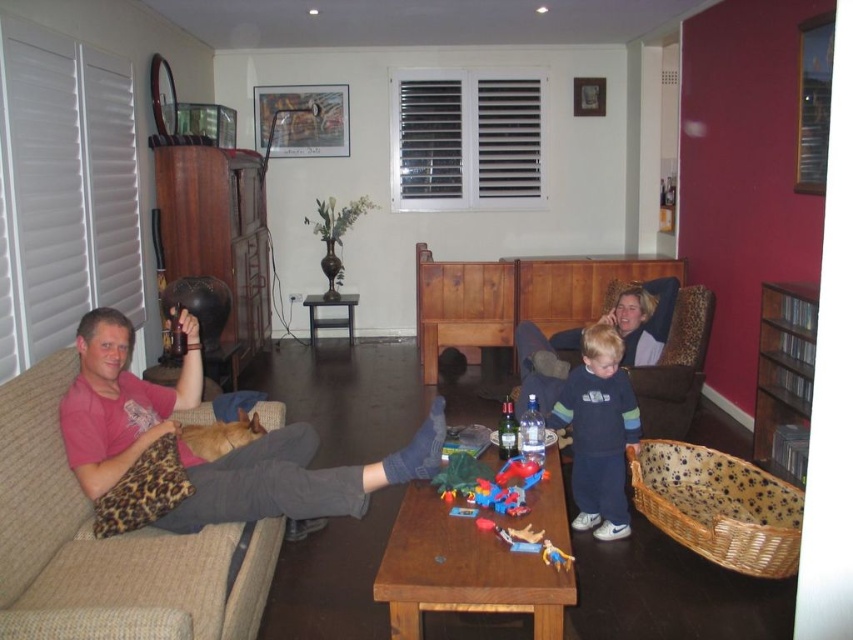
Image resolution: width=853 pixels, height=640 pixels. What do you see at coordinates (108, 545) in the screenshot?
I see `beige fabric couch at left` at bounding box center [108, 545].

Can you confirm if beige fabric couch at left is bigger than dark blue fleece at center?

Yes, beige fabric couch at left is bigger than dark blue fleece at center.

This screenshot has width=853, height=640. I want to click on beige fabric couch at left, so click(x=108, y=545).

Is point (96, 397) in front of point (630, 412)?

Yes, it is.

At what (x,y) coordinates should I click in order to perform the action: click on pink cotton shirt at left. Please return your answer as a coordinate pair (x, y). The image size is (853, 640). Looking at the image, I should click on (294, 477).

Who is taller, beige fabric couch at left or pink cotton shirt at left?

With more height is beige fabric couch at left.

Measure the distance from beige fabric couch at left to pink cotton shirt at left.

beige fabric couch at left and pink cotton shirt at left are 10.05 inches apart.

The height and width of the screenshot is (640, 853). Identify the location of beige fabric couch at left. (108, 545).

At what (x,y) coordinates should I click in order to perform the action: click on beige fabric couch at left. Please return your answer as a coordinate pair (x, y). Image resolution: width=853 pixels, height=640 pixels. Looking at the image, I should click on (108, 545).